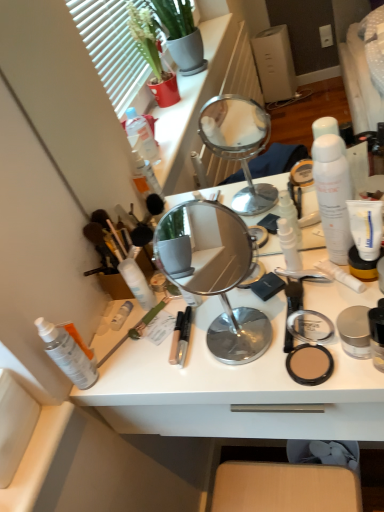
The image size is (384, 512). Find the location of `vacant space positioned to the left of matte beige compact at right`. vacant space positioned to the left of matte beige compact at right is located at coordinates (223, 373).